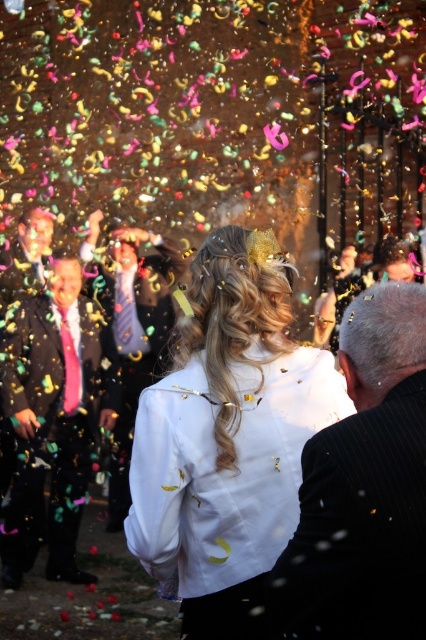
Is white satin dress at center smaller than shiny pink tie at left?

Indeed, white satin dress at center has a smaller size compared to shiny pink tie at left.

Does white satin dress at center appear on the left side of shiny pink tie at left?

Incorrect, white satin dress at center is not on the left side of shiny pink tie at left.

Between point (273, 394) and point (98, 397), which one is positioned behind?

Positioned behind is point (98, 397).

Where is `white satin dress at center`? white satin dress at center is located at coordinates (227, 435).

Is shiny pink tie at left closer to the viewer compared to matte black suit at left?

Yes, shiny pink tie at left is in front of matte black suit at left.

Does shiny pink tie at left appear on the left side of matte black suit at left?

Yes, shiny pink tie at left is to the left of matte black suit at left.

Who is more forward, (97, 339) or (126, 404)?

Point (97, 339) is more forward.

In order to click on shiny pink tie at left in this screenshot , I will do `click(54, 419)`.

Who is shorter, black pinstripe suit at right or shiny pink tie at left?

With less height is black pinstripe suit at right.

Is black pinstripe suit at right closer to the viewer compared to shiny pink tie at left?

Yes, it is.

Image resolution: width=426 pixels, height=640 pixels. Identify the location of black pinstripe suit at right. 365,486.

At what (x,y) coordinates should I click in order to perform the action: click on black pinstripe suit at right. Please return your answer as a coordinate pair (x, y). Looking at the image, I should click on (365, 486).